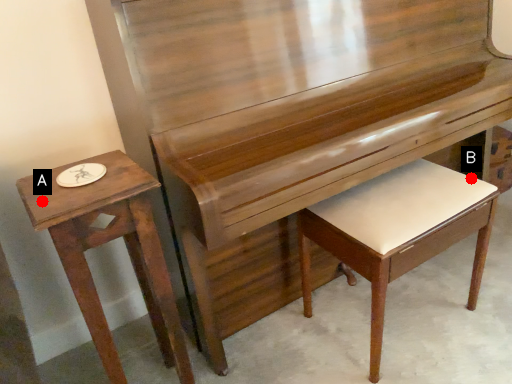
Question: Two points are circled on the image, labeled by A and B beside each circle. Which of the following is the farthest from the observer?

Choices:
 (A) A is further
 (B) B is further

Answer: (B)